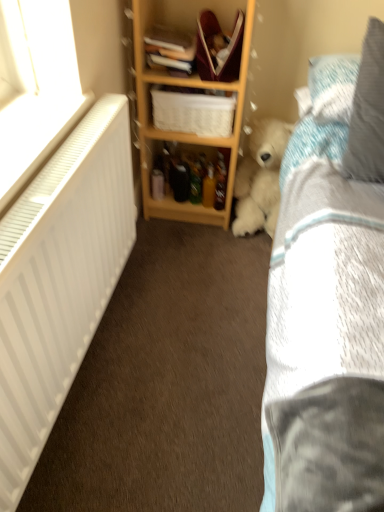
Question: From a real-world perspective, is fluffy white teddy bear at lower right beneath blue textured pillow at upper right, which ranks as the first pillow in back-to-front order?

Choices:
 (A) no
 (B) yes

Answer: (B)

Question: Does fluffy white teddy bear at lower right come behind blue textured pillow at upper right, which ranks as the first pillow in back-to-front order?

Choices:
 (A) yes
 (B) no

Answer: (A)

Question: Can you confirm if fluffy white teddy bear at lower right is bigger than blue textured pillow at upper right, positioned as the 2th pillow in front-to-back order?

Choices:
 (A) no
 (B) yes

Answer: (B)

Question: Is blue textured pillow at upper right, positioned as the 2th pillow in front-to-back order, located within fluffy white teddy bear at lower right?

Choices:
 (A) no
 (B) yes

Answer: (A)

Question: Is fluffy white teddy bear at lower right shorter than blue textured pillow at upper right, positioned as the 2th pillow in front-to-back order?

Choices:
 (A) no
 (B) yes

Answer: (A)

Question: From their relative heights in the image, would you say wooden shelf at center is taller or shorter than blue textured pillow at upper right, positioned as the 2th pillow in front-to-back order?

Choices:
 (A) tall
 (B) short

Answer: (A)

Question: Is point (248, 3) positioned closer to the camera than point (314, 57)?

Choices:
 (A) farther
 (B) closer

Answer: (B)

Question: From a real-world perspective, is wooden shelf at center above or below blue textured pillow at upper right, positioned as the 2th pillow in front-to-back order?

Choices:
 (A) below
 (B) above

Answer: (A)

Question: Is wooden shelf at center in front of or behind blue textured pillow at upper right, positioned as the 2th pillow in front-to-back order, in the image?

Choices:
 (A) behind
 (B) front

Answer: (A)

Question: Is point (175, 136) closer or farther from the camera than point (263, 142)?

Choices:
 (A) farther
 (B) closer

Answer: (B)

Question: In terms of height, does wooden shelf at center look taller or shorter compared to fluffy white teddy bear at lower right?

Choices:
 (A) short
 (B) tall

Answer: (B)

Question: Relative to fluffy white teddy bear at lower right, is wooden shelf at center in front or behind?

Choices:
 (A) front
 (B) behind

Answer: (A)

Question: Would you say wooden shelf at center is inside or outside fluffy white teddy bear at lower right?

Choices:
 (A) inside
 (B) outside

Answer: (B)

Question: In terms of size, does hardcover book at upper center, marked as the second book in a top-to-bottom arrangement, appear bigger or smaller than white plastic radiator at left?

Choices:
 (A) big
 (B) small

Answer: (B)

Question: From a real-world perspective, is hardcover book at upper center, marked as the second book in a top-to-bottom arrangement, positioned above or below white plastic radiator at left?

Choices:
 (A) below
 (B) above

Answer: (B)